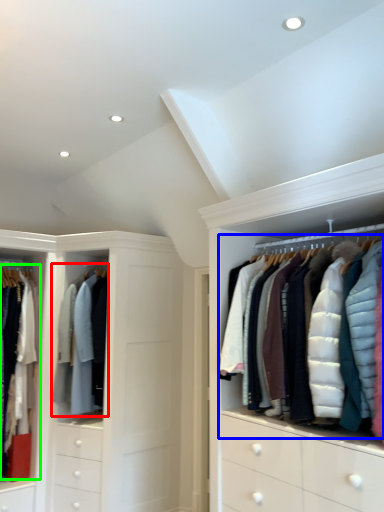
Question: Which is farther away from clothing (highlighted by a red box)? garment (highlighted by a blue box) or clothing (highlighted by a green box)?

Choices:
 (A) garment
 (B) clothing

Answer: (A)